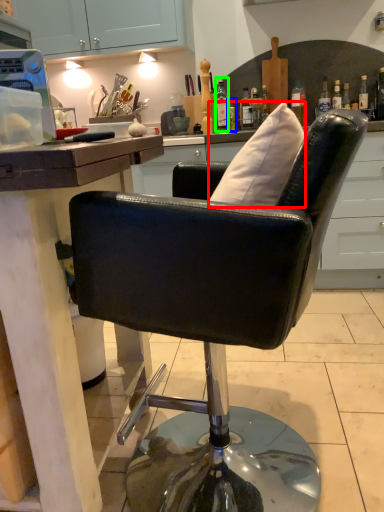
Question: Estimate the real-world distances between objects in this image. Which object is farther from pillow (highlighted by a red box), bottle (highlighted by a blue box) or bottle (highlighted by a green box)?

Choices:
 (A) bottle
 (B) bottle

Answer: (B)